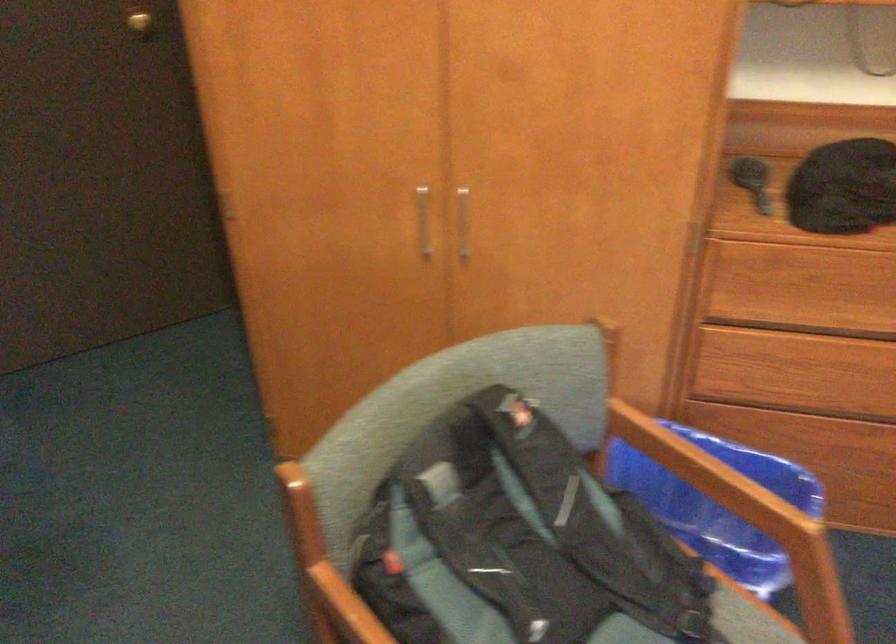
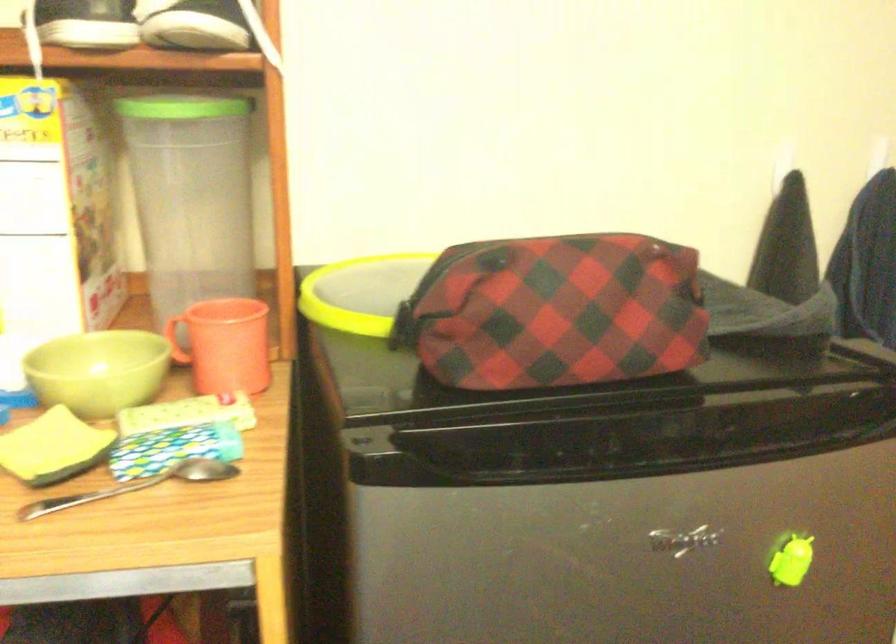
Question: Based on the continuous images, in which direction is the camera rotating? Reply with the corresponding letter.

Choices:
 (A) Left
 (B) Right
 (C) Up
 (D) Down

Answer: (A)